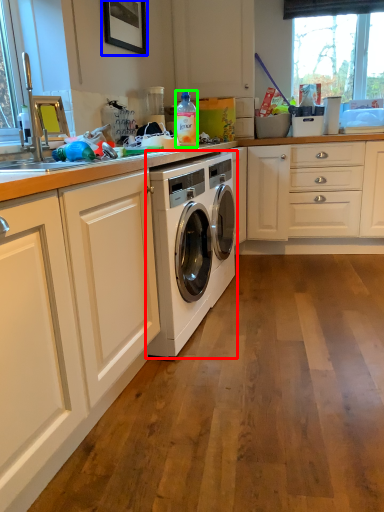
Question: Considering the real-world distances, which object is closest to washing machine (highlighted by a red box)? picture frame (highlighted by a blue box) or bottle (highlighted by a green box).

Choices:
 (A) picture frame
 (B) bottle

Answer: (B)